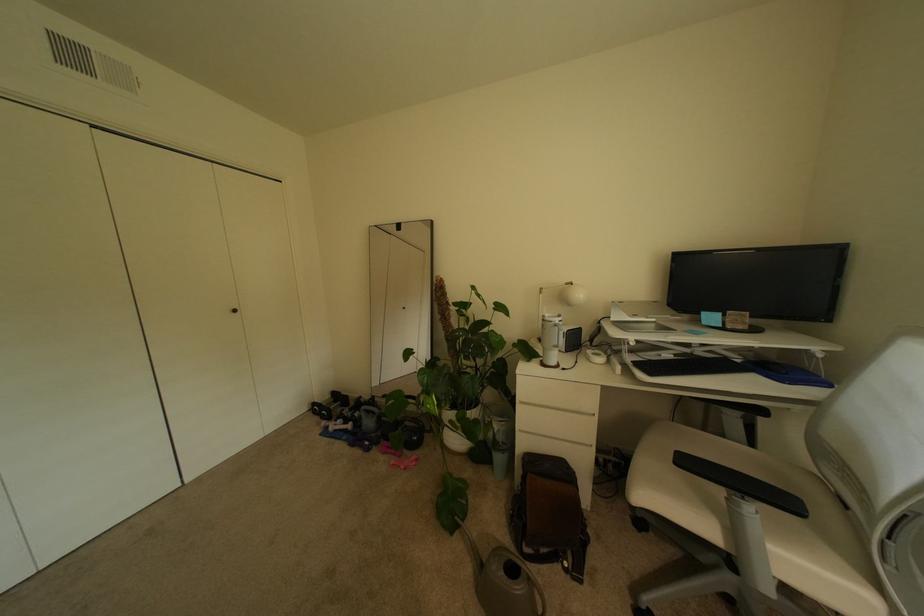
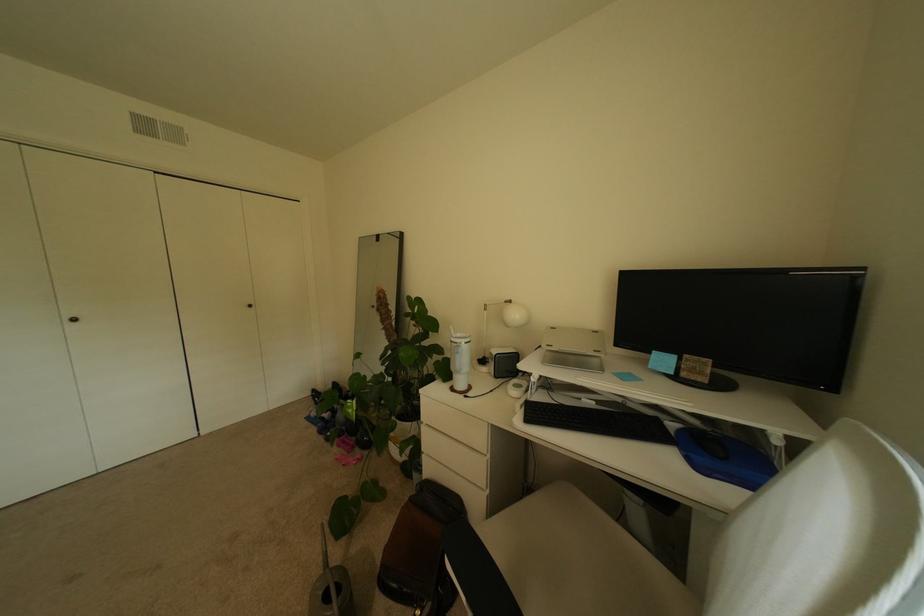
Question: What movement of the cameraman would produce the second image?

Choices:
 (A) Left
 (B) Right
 (C) Forward
 (D) Backward

Answer: (B)